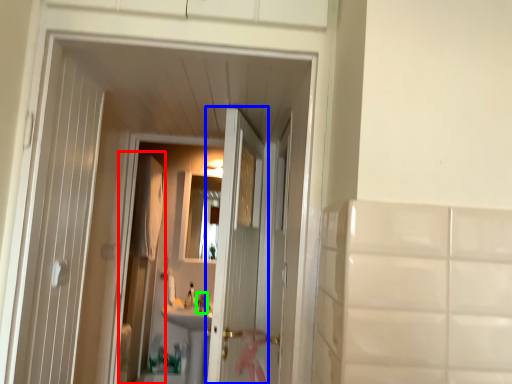
Question: Which is nearer to the screen door (highlighted by a red box)? door (highlighted by a blue box) or faucet (highlighted by a green box).

Choices:
 (A) door
 (B) faucet

Answer: (B)